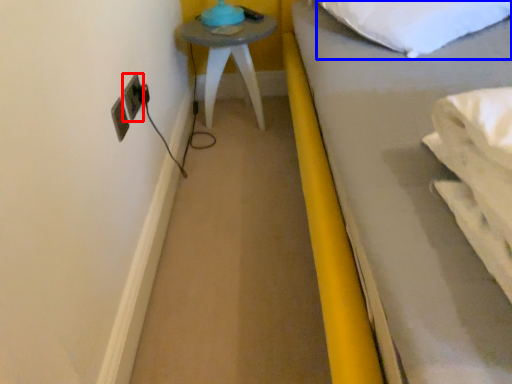
Question: Which object is closer to the camera taking this photo, electric outlet (highlighted by a red box) or pillow (highlighted by a blue box)?

Choices:
 (A) electric outlet
 (B) pillow

Answer: (B)